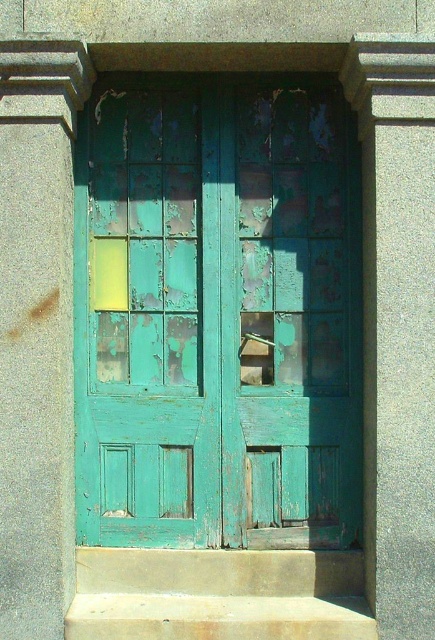
Who is taller, peeling teal wood door at center or concrete steps at center?

peeling teal wood door at center is taller.

Is peeling teal wood door at center positioned at the back of concrete steps at center?

That is True.

What do you see at coordinates (217, 314) in the screenshot? I see `peeling teal wood door at center` at bounding box center [217, 314].

At what (x,y) coordinates should I click in order to perform the action: click on peeling teal wood door at center. Please return your answer as a coordinate pair (x, y). Looking at the image, I should click on (217, 314).